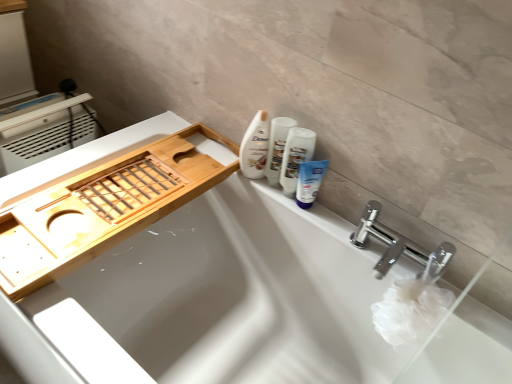
Locate an element on the screen. blue matte tube at upper right, the 1th toiletry positioned from the right is located at coordinates (309, 182).

The width and height of the screenshot is (512, 384). Describe the element at coordinates (277, 147) in the screenshot. I see `white glossy lotion at upper right, the 2th toiletry positioned from the right` at that location.

Identify the location of blue matte tube at upper right, the second toiletry in the left-to-right sequence. (309, 182).

Consider the image. Can you confirm if white glossy bottle at upper center is thinner than white glossy bathtub at upper center?

Indeed, white glossy bottle at upper center has a lesser width compared to white glossy bathtub at upper center.

Is white glossy bottle at upper center next to white glossy bathtub at upper center and touching it?

white glossy bottle at upper center is not next to white glossy bathtub at upper center, and they're not touching.

Which object is further away from the camera, white glossy bottle at upper center or white glossy bathtub at upper center?

white glossy bottle at upper center is more distant.

Consider the image. Can you confirm if white glossy bottle at upper center is positioned to the left of white glossy bathtub at upper center?

No, white glossy bottle at upper center is not to the left of white glossy bathtub at upper center.

Could you tell me if blue matte tube at upper right, the second toiletry in the left-to-right sequence, is facing white glossy bottle at upper center?

No, blue matte tube at upper right, the second toiletry in the left-to-right sequence, is not aimed at white glossy bottle at upper center.

Who is smaller, blue matte tube at upper right, the second toiletry in the left-to-right sequence, or white glossy bottle at upper center?

blue matte tube at upper right, the second toiletry in the left-to-right sequence.

In the image, is blue matte tube at upper right, the 1th toiletry positioned from the right, positioned in front of or behind white glossy bottle at upper center?

blue matte tube at upper right, the 1th toiletry positioned from the right, is positioned closer to the viewer than white glossy bottle at upper center.

Considering the points (278, 137) and (245, 143), which point is in front, point (278, 137) or point (245, 143)?

The point (278, 137) is closer to the camera.

Is white glossy lotion at upper right, the 2th toiletry positioned from the right, aimed at white glossy bottle at upper center?

No, white glossy lotion at upper right, the 2th toiletry positioned from the right, is not turned towards white glossy bottle at upper center.

Which of these two, white glossy lotion at upper right, the 2th toiletry positioned from the right, or white glossy bottle at upper center, is wider?

white glossy bottle at upper center.

From the image's perspective, relative to white glossy bottle at upper center, is white glossy lotion at upper right, the 2th toiletry positioned from the right, above or below?

white glossy lotion at upper right, the 2th toiletry positioned from the right, is situated lower than white glossy bottle at upper center in the image.

You are a GUI agent. You are given a task and a screenshot of the screen. Output one action in this format:
    pyautogui.click(x=<x>, y=<y>)
    Task: Click on the bathtub that is on the left side of blue matte tube at upper right, the second toiletry in the left-to-right sequence
    
    Given the screenshot: What is the action you would take?
    pyautogui.click(x=214, y=302)

Relative to blue matte tube at upper right, the 1th toiletry positioned from the right, is white glossy bathtub at upper center in front or behind?

In the image, white glossy bathtub at upper center appears in front of blue matte tube at upper right, the 1th toiletry positioned from the right.

Visually, is white glossy bathtub at upper center positioned to the left or to the right of blue matte tube at upper right, the second toiletry in the left-to-right sequence?

white glossy bathtub at upper center is positioned on blue matte tube at upper right, the second toiletry in the left-to-right sequence,'s left side.

From the picture: Can we say white glossy tube at upper right lies outside blue matte tube at upper right, the second toiletry in the left-to-right sequence?

That's correct, white glossy tube at upper right is outside of blue matte tube at upper right, the second toiletry in the left-to-right sequence.

Would you consider white glossy tube at upper right to be distant from blue matte tube at upper right, the second toiletry in the left-to-right sequence?

No, white glossy tube at upper right is not far away from blue matte tube at upper right, the second toiletry in the left-to-right sequence.

Could you tell me if white glossy tube at upper right is turned towards blue matte tube at upper right, the second toiletry in the left-to-right sequence?

Yes, white glossy tube at upper right is facing blue matte tube at upper right, the second toiletry in the left-to-right sequence.

From a real-world perspective, which is physically above, white glossy tube at upper right or white glossy bathtub at upper center?

white glossy tube at upper right.

The height and width of the screenshot is (384, 512). I want to click on bathtub located below the white glossy tube at upper right (from the image's perspective), so click(214, 302).

Is white glossy tube at upper right at the left side of white glossy bathtub at upper center?

In fact, white glossy tube at upper right is to the right of white glossy bathtub at upper center.

Is white glossy bottle at upper center touching white glossy lotion at upper right, the 2th toiletry positioned from the right?

Indeed, white glossy bottle at upper center and white glossy lotion at upper right, the 2th toiletry positioned from the right, are beside each other and touching.

Considering the sizes of white glossy bottle at upper center and white glossy lotion at upper right, the 2th toiletry positioned from the right, in the image, is white glossy bottle at upper center taller or shorter than white glossy lotion at upper right, the 2th toiletry positioned from the right,?

Clearly, white glossy bottle at upper center is taller compared to white glossy lotion at upper right, the 2th toiletry positioned from the right.

Is white glossy bottle at upper center facing away from white glossy lotion at upper right, arranged as the first toiletry when viewed from the left?

white glossy bottle at upper center is not turned away from white glossy lotion at upper right, arranged as the first toiletry when viewed from the left.

Who is smaller, white glossy bottle at upper center or white glossy lotion at upper right, the 2th toiletry positioned from the right?

With smaller size is white glossy lotion at upper right, the 2th toiletry positioned from the right.

Locate an element on the screen. bathtub that is under the white glossy bottle at upper center (from a real-world perspective) is located at coordinates (214, 302).

Where is `toiletry that is the 2nd one when counting forward from the white glossy bottle at upper center`? This screenshot has width=512, height=384. toiletry that is the 2nd one when counting forward from the white glossy bottle at upper center is located at coordinates (309, 182).

Looking at the image, which one is located further to white glossy tube at upper right, white glossy bathtub at upper center or blue matte tube at upper right, the 1th toiletry positioned from the right?

white glossy bathtub at upper center lies further to white glossy tube at upper right than the other object.

Looking at the image, which one is located further to blue matte tube at upper right, the second toiletry in the left-to-right sequence, white glossy lotion at upper right, arranged as the first toiletry when viewed from the left, or white glossy bottle at upper center?

Based on the image, white glossy bottle at upper center appears to be further to blue matte tube at upper right, the second toiletry in the left-to-right sequence.

Based on their spatial positions, is white glossy tube at upper right or white glossy lotion at upper right, arranged as the first toiletry when viewed from the left, further from white glossy bathtub at upper center?

white glossy lotion at upper right, arranged as the first toiletry when viewed from the left, is further to white glossy bathtub at upper center.

Which object lies nearer to the anchor point blue matte tube at upper right, the 1th toiletry positioned from the right, white glossy bottle at upper center or white glossy lotion at upper right, the 2th toiletry positioned from the right?

white glossy lotion at upper right, the 2th toiletry positioned from the right.

From the image, which object appears to be farther from white glossy lotion at upper right, arranged as the first toiletry when viewed from the left, white glossy bathtub at upper center or white glossy bottle at upper center?

The object further to white glossy lotion at upper right, arranged as the first toiletry when viewed from the left, is white glossy bathtub at upper center.

Considering their positions, is white glossy tube at upper right positioned further to white glossy lotion at upper right, the 2th toiletry positioned from the right, than blue matte tube at upper right, the second toiletry in the left-to-right sequence?

blue matte tube at upper right, the second toiletry in the left-to-right sequence, lies further to white glossy lotion at upper right, the 2th toiletry positioned from the right, than the other object.

Considering their positions, is white glossy bottle at upper center positioned further to white glossy bathtub at upper center than white glossy lotion at upper right, arranged as the first toiletry when viewed from the left?

white glossy lotion at upper right, arranged as the first toiletry when viewed from the left, is further to white glossy bathtub at upper center.

Looking at the image, which one is located closer to white glossy bottle at upper center, white glossy tube at upper right or blue matte tube at upper right, the 1th toiletry positioned from the right?

Based on the image, white glossy tube at upper right appears to be nearer to white glossy bottle at upper center.

You are a GUI agent. You are given a task and a screenshot of the screen. Output one action in this format:
    pyautogui.click(x=<x>, y=<y>)
    Task: Click on the mouthwash between white glossy lotion at upper right, arranged as the first toiletry when viewed from the left, and blue matte tube at upper right, the second toiletry in the left-to-right sequence, in the up-down direction
    This screenshot has width=512, height=384.
    Given the screenshot: What is the action you would take?
    pyautogui.click(x=295, y=157)

Where is `mouthwash between white glossy bathtub at upper center and white glossy bottle at upper center in the front-back direction`? mouthwash between white glossy bathtub at upper center and white glossy bottle at upper center in the front-back direction is located at coordinates (295, 157).

You are a GUI agent. You are given a task and a screenshot of the screen. Output one action in this format:
    pyautogui.click(x=<x>, y=<y>)
    Task: Click on the toiletry between white glossy bathtub at upper center and white glossy lotion at upper right, arranged as the first toiletry when viewed from the left, from front to back
    The height and width of the screenshot is (384, 512).
    Given the screenshot: What is the action you would take?
    pyautogui.click(x=309, y=182)

Where is `toiletry between white glossy bottle at upper center and blue matte tube at upper right, the 1th toiletry positioned from the right, in the horizontal direction`? This screenshot has height=384, width=512. toiletry between white glossy bottle at upper center and blue matte tube at upper right, the 1th toiletry positioned from the right, in the horizontal direction is located at coordinates (277, 147).